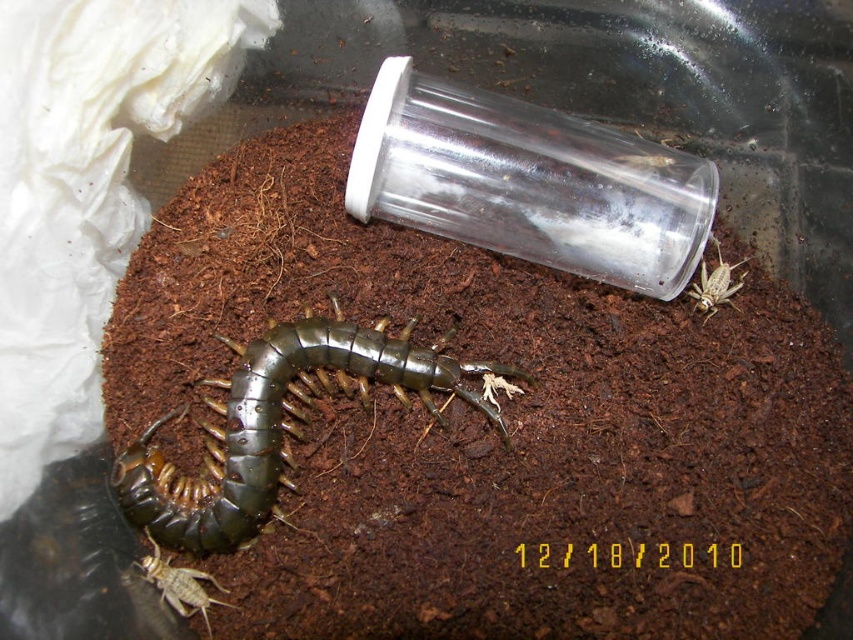
You are an entomologist observing the terrarium. You need to determine if the brown soil at center can fully cover the translucent brown cricket at lower left. Based on their sizes, what do you conclude?

The brown soil at center is wider than the translucent brown cricket at lower left, so it can fully cover the cricket.

You are a scientist observing the terrarium. You need to determine which insect is wider when viewed from above. Which one is wider between the shiny metallic centipede at center and the translucent brown cricket at lower left?

The shiny metallic centipede at center is wider than the translucent brown cricket at lower left.

You are observing the terrarium and want to place a tiny food pellet at the point that is closer to you. Which point should you choose between point (306,360) and point (704,280)?

Point (306,360) is in front of point (704,280), so you should choose point (306,360) as it is closer to you.